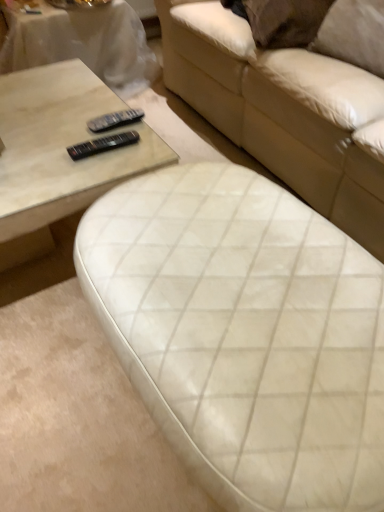
Where is `free space to the back side of black plastic remote at center, which is counted as the 1th remote, starting from the bottom`? free space to the back side of black plastic remote at center, which is counted as the 1th remote, starting from the bottom is located at coordinates (87, 119).